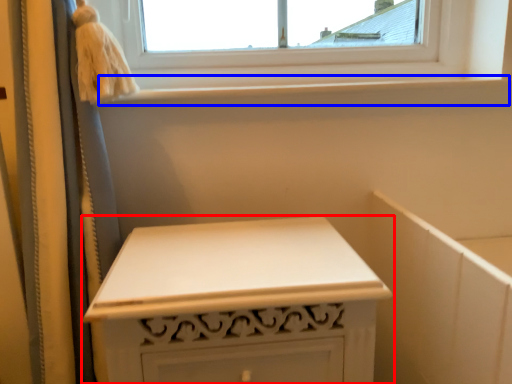
Question: Among these objects, which one is farthest to the camera, furniture (highlighted by a red box) or window sill (highlighted by a blue box)?

Choices:
 (A) furniture
 (B) window sill

Answer: (B)